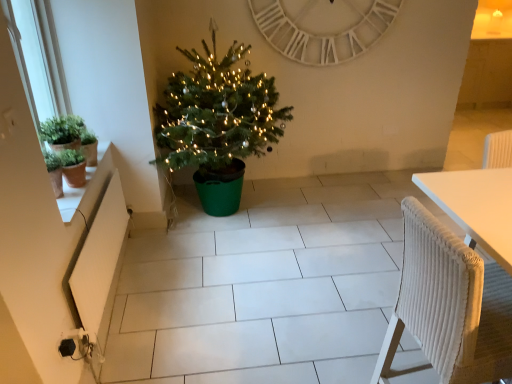
What do you see at coordinates (100, 262) in the screenshot?
I see `white matte radiator at lower left` at bounding box center [100, 262].

Describe the element at coordinates (86, 183) in the screenshot. I see `terracotta clay pot at left` at that location.

This screenshot has width=512, height=384. What are the coordinates of `white wooden clock at upper center` in the screenshot? It's located at (324, 28).

Which point is more distant from viewer, (104,148) or (475,263)?

The point (104,148) is more distant.

From the image's perspective, is terracotta clay pot at left under white woven chair at right?

No.

In the image, is terracotta clay pot at left positioned in front of or behind white woven chair at right?

Clearly, terracotta clay pot at left is behind white woven chair at right.

Is point (163, 120) closer to camera compared to point (471, 255)?

No, it is not.

How distant is green plastic christmas tree at center from white woven chair at right?

green plastic christmas tree at center and white woven chair at right are 5.72 feet apart from each other.

Considering the sizes of objects green plastic christmas tree at center and white woven chair at right in the image provided, who is taller, green plastic christmas tree at center or white woven chair at right?

With more height is green plastic christmas tree at center.

Consider the image. Is green plastic christmas tree at center oriented towards white woven chair at right?

Yes, green plastic christmas tree at center is aimed at white woven chair at right.

Is the surface of white wooden clock at upper center in direct contact with terracotta clay pot at left?

Answer: No, white wooden clock at upper center is not making contact with terracotta clay pot at left.

Looking at this image, considering the relative sizes of white wooden clock at upper center and terracotta clay pot at left in the image provided, is white wooden clock at upper center shorter than terracotta clay pot at left?

No.

In the scene shown: Is white wooden clock at upper center facing towards terracotta clay pot at left?

No, white wooden clock at upper center is not oriented towards terracotta clay pot at left.

Based on their sizes in the image, would you say white wooden clock at upper center is bigger or smaller than terracotta clay pot at left?

In the image, white wooden clock at upper center appears to be larger than terracotta clay pot at left.

Is green matte pot at left aimed at terracotta clay pot at left?

No, green matte pot at left is not oriented towards terracotta clay pot at left.

Is terracotta clay pot at left completely or partially inside green matte pot at left?

That's incorrect, terracotta clay pot at left is not inside green matte pot at left.

Does green matte pot at left appear on the right side of terracotta clay pot at left?

No, green matte pot at left is not to the right of terracotta clay pot at left.

Which point is more distant from viewer, (x=47, y=133) or (x=221, y=144)?

Positioned behind is point (x=221, y=144).

Which object is more forward, green matte pot at left or green plastic christmas tree at center?

Positioned in front is green matte pot at left.

Is green matte pot at left located outside green plastic christmas tree at center?

Yes, green matte pot at left is outside of green plastic christmas tree at center.

This screenshot has width=512, height=384. What are the coordinates of `houseplant in front of the green plastic christmas tree at center` in the screenshot? It's located at (69, 136).

Considering the sizes of white wooden clock at upper center and white matte radiator at lower left in the image, is white wooden clock at upper center wider or thinner than white matte radiator at lower left?

Considering their sizes, white wooden clock at upper center looks broader than white matte radiator at lower left.

Considering the relative positions of white wooden clock at upper center and white matte radiator at lower left in the image provided, is white wooden clock at upper center to the left or to the right of white matte radiator at lower left?

white wooden clock at upper center is positioned on white matte radiator at lower left's right side.

From a real-world perspective, is white wooden clock at upper center physically located above or below white matte radiator at lower left?

Clearly, from a real-world perspective, white wooden clock at upper center is above white matte radiator at lower left.

How much distance is there between white wooden clock at upper center and white matte radiator at lower left?

A distance of 6.42 feet exists between white wooden clock at upper center and white matte radiator at lower left.

Is white woven chair at right turned away from green matte pot at left?

white woven chair at right is not turned away from green matte pot at left.

How many degrees apart are the facing directions of white woven chair at right and green matte pot at left?

The facing directions of white woven chair at right and green matte pot at left are 0.823 degrees apart.

Consider the image. Between white woven chair at right and green matte pot at left, which one appears on the left side from the viewer's perspective?

green matte pot at left.

From the picture: Which of these two, white woven chair at right or green matte pot at left, stands taller?

white woven chair at right.

The image size is (512, 384). In order to click on window sill located on the left of white woven chair at right in this screenshot , I will do `click(86, 183)`.

What are the coordinates of `chair that appears below the green plastic christmas tree at center (from the image's perspective)` in the screenshot? It's located at (449, 306).

When comparing their distances from white matte radiator at lower left, does white woven chair at right or terracotta clay pot at left seem further?

white woven chair at right is further to white matte radiator at lower left.

From the image, which object appears to be nearer to white wooden clock at upper center, white woven chair at right or green matte pot at left?

green matte pot at left.

Which object lies nearer to the anchor point white woven chair at right, white wooden clock at upper center or green matte pot at left?

Among the two, green matte pot at left is located nearer to white woven chair at right.

Based on the photo, from the image, which object appears to be farther from white wooden clock at upper center, white woven chair at right or white matte radiator at lower left?

white woven chair at right is positioned further to the anchor white wooden clock at upper center.

Looking at the image, which one is located closer to terracotta clay pot at left, white woven chair at right or green plastic christmas tree at center?

Based on the image, green plastic christmas tree at center appears to be nearer to terracotta clay pot at left.

Based on their spatial positions, is green matte pot at left or white woven chair at right further from green plastic christmas tree at center?

Based on the image, white woven chair at right appears to be further to green plastic christmas tree at center.

Estimate the real-world distances between objects in this image. Which object is closer to green plastic christmas tree at center, white wooden clock at upper center or terracotta clay pot at left?

terracotta clay pot at left lies closer to green plastic christmas tree at center than the other object.

Looking at the image, which one is located closer to terracotta clay pot at left, white matte radiator at lower left or green matte pot at left?

green matte pot at left is closer to terracotta clay pot at left.

Identify the location of houseplant between white woven chair at right and white wooden clock at upper center from front to back. The height and width of the screenshot is (384, 512). (69, 136).

Identify the location of christmas tree located between green matte pot at left and white woven chair at right in the left-right direction. Image resolution: width=512 pixels, height=384 pixels. (217, 114).

The width and height of the screenshot is (512, 384). Find the location of `radiator between green matte pot at left and white woven chair at right in the horizontal direction`. radiator between green matte pot at left and white woven chair at right in the horizontal direction is located at coordinates coord(100,262).

Find the location of a particular element. This screenshot has height=384, width=512. christmas tree situated between terracotta clay pot at left and white woven chair at right from left to right is located at coordinates (217, 114).